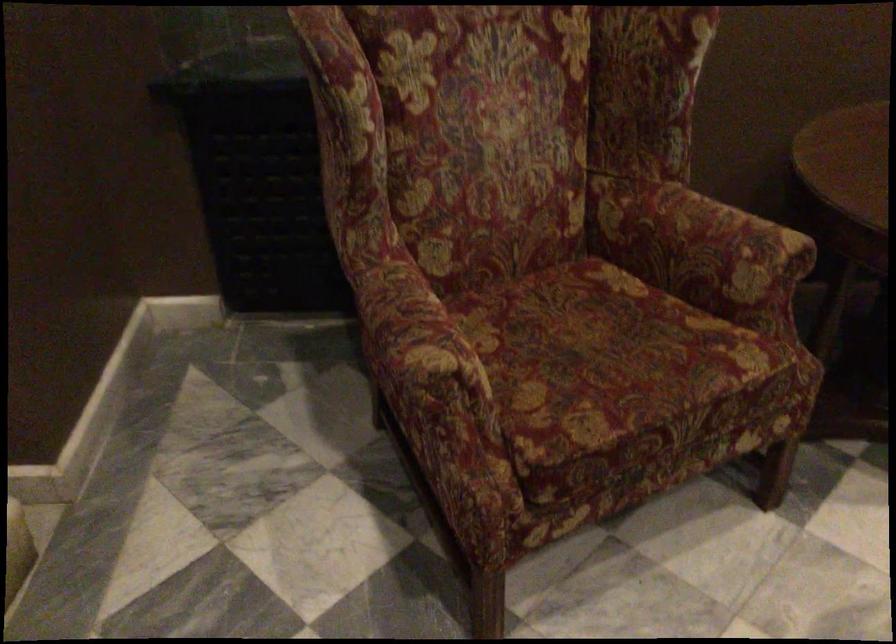
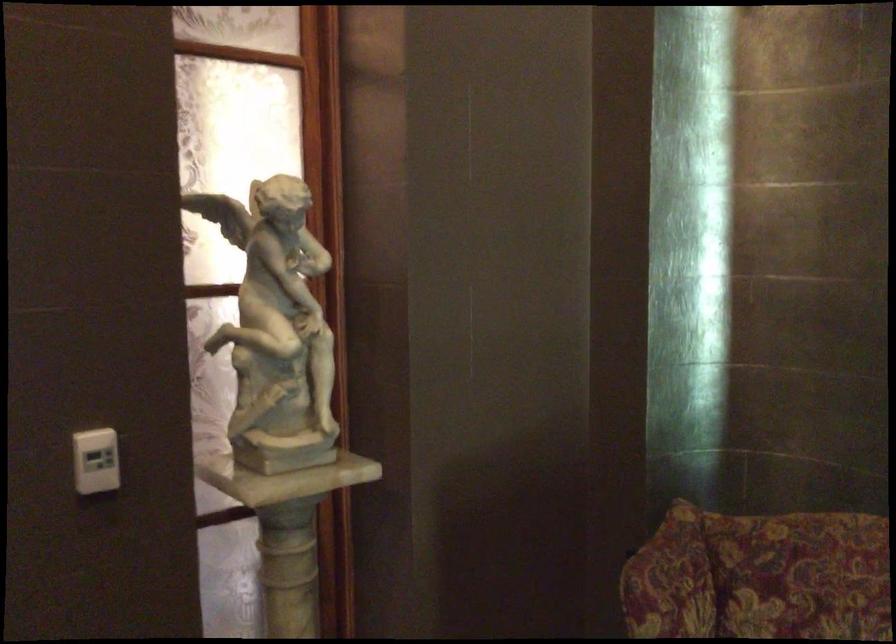
Question: The camera is either moving clockwise (left) or counter-clockwise (right) around the object. The first image is from the beginning of the video and the second image is from the end. Is the camera moving left or right when shooting the video?

Choices:
 (A) Left
 (B) Right

Answer: (B)